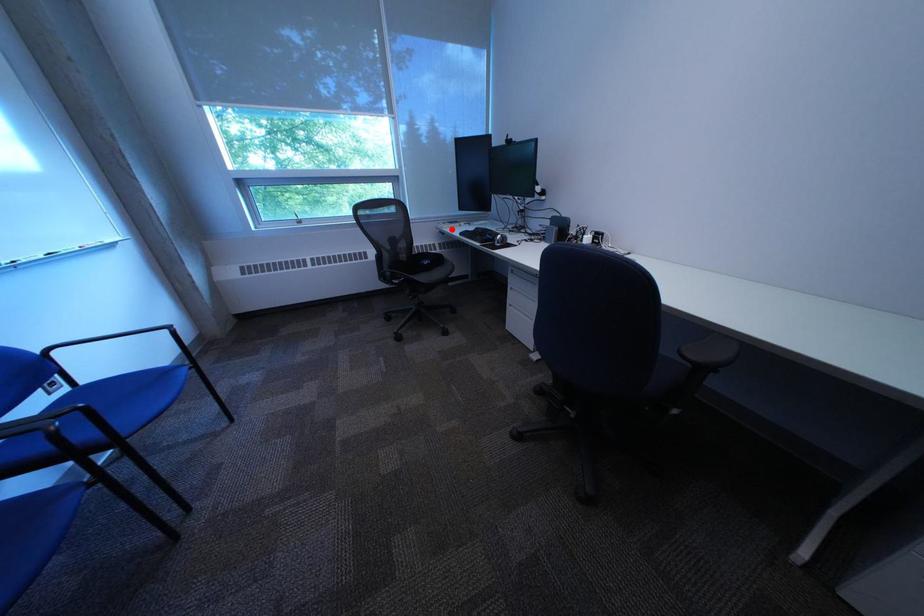
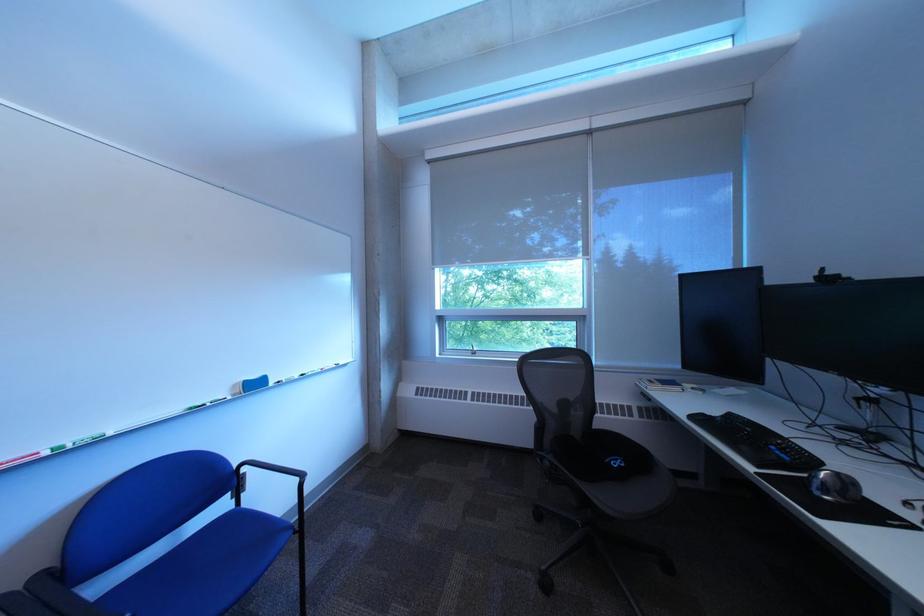
Locate, in the second image, the point that corresponds to the highlighted location in the first image.

(651, 386)